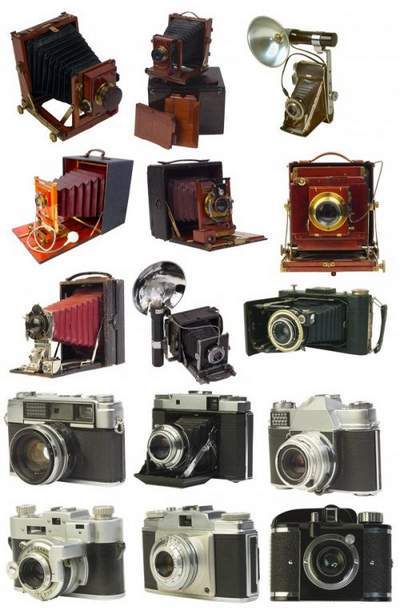
This screenshot has height=610, width=400. Identify the location of bulb. (158, 287), (273, 36).